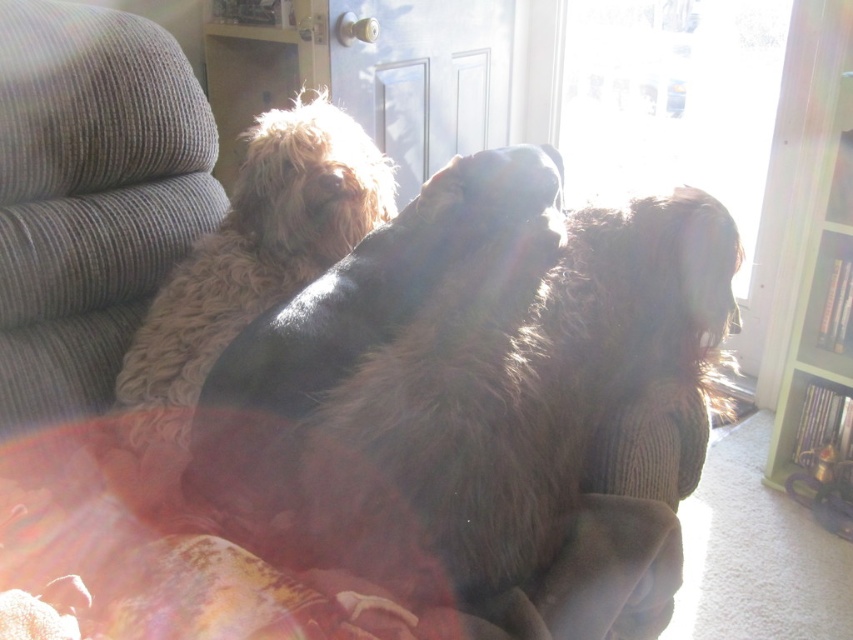
Can you confirm if fuzzy brown dog at center is bigger than fluffy beige dog at upper left?

Yes, fuzzy brown dog at center is bigger than fluffy beige dog at upper left.

Does fuzzy brown dog at center lie in front of fluffy beige dog at upper left?

That is True.

The height and width of the screenshot is (640, 853). What are the coordinates of `fuzzy brown dog at center` in the screenshot? It's located at (463, 385).

Does fuzzy brown dog at center have a greater height compared to fluffy multicolored blanket at center?

Yes.

Is point (579, 339) behind point (62, 540)?

That is True.

The image size is (853, 640). Identify the location of fuzzy brown dog at center. (463, 385).

Consider the image. Is fluffy beige dog at upper left behind green painted wood bookshelf at right?

No, it is in front of green painted wood bookshelf at right.

Between point (310, 100) and point (837, 88), which one is positioned in front?

Positioned in front is point (837, 88).

Where is `fluffy beige dog at upper left`? This screenshot has width=853, height=640. fluffy beige dog at upper left is located at coordinates (253, 257).